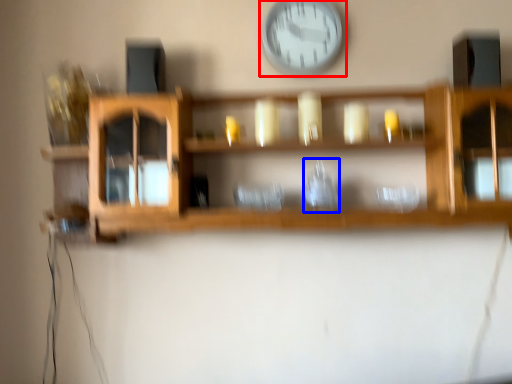
Question: Which object appears farthest to the camera in this image, wall clock (highlighted by a red box) or glass vase (highlighted by a blue box)?

Choices:
 (A) wall clock
 (B) glass vase

Answer: (A)